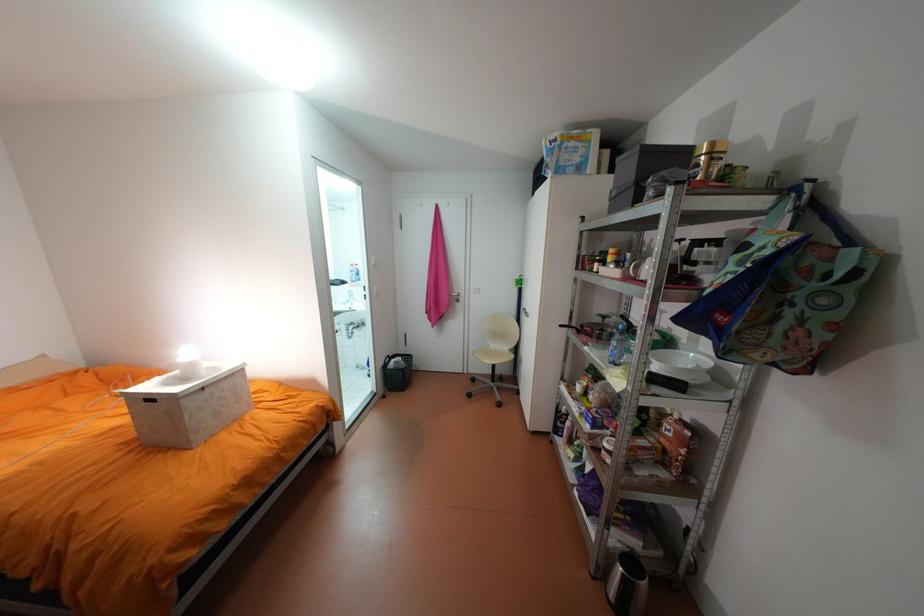
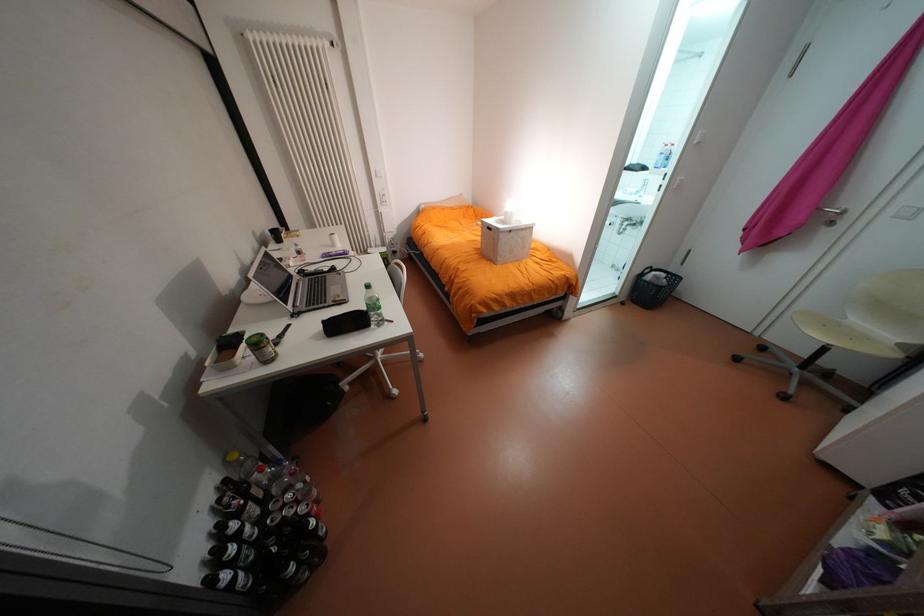
In the second image, find the point that corresponds to pixel 191 400 in the first image.

(509, 233)